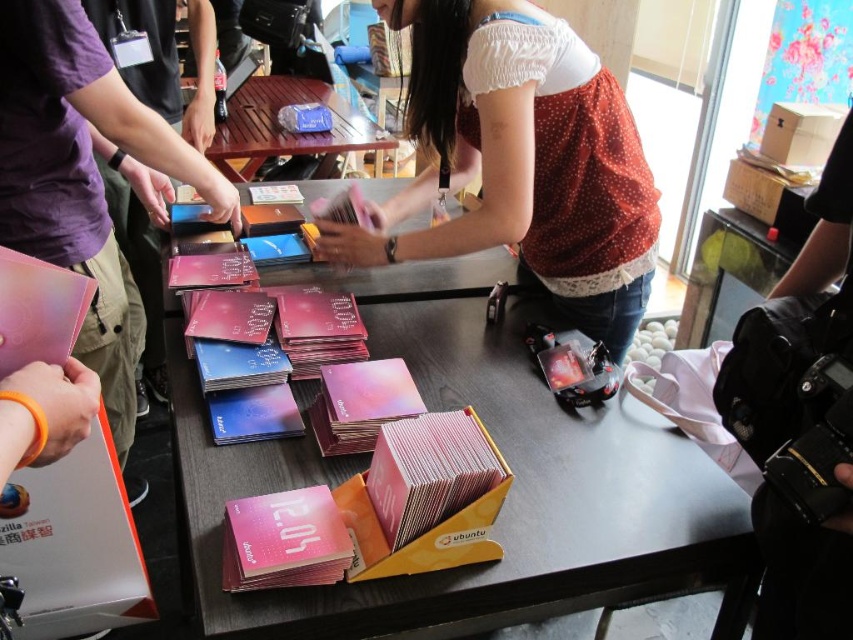
Question: Does matte pink fabric at center appear over matte black laptop at left?

Choices:
 (A) no
 (B) yes

Answer: (B)

Question: Which point is closer to the camera?

Choices:
 (A) (241, 211)
 (B) (74, 310)
 (C) (223, 433)

Answer: (B)

Question: Is matte black laptop at left to the right of pink matte card at center from the viewer's perspective?

Choices:
 (A) yes
 (B) no

Answer: (B)

Question: Is matte pink fabric at center smaller than pink glossy card at center?

Choices:
 (A) no
 (B) yes

Answer: (A)

Question: Which is farther from the matte pink card at left?

Choices:
 (A) pink matte card at center
 (B) matte pink fabric at center
 (C) pink glossy card at center

Answer: (B)

Question: Which point is farther from the camera taking this photo?

Choices:
 (A) (277, 198)
 (B) (53, 45)
 (C) (354, 145)
 (D) (22, 339)

Answer: (C)